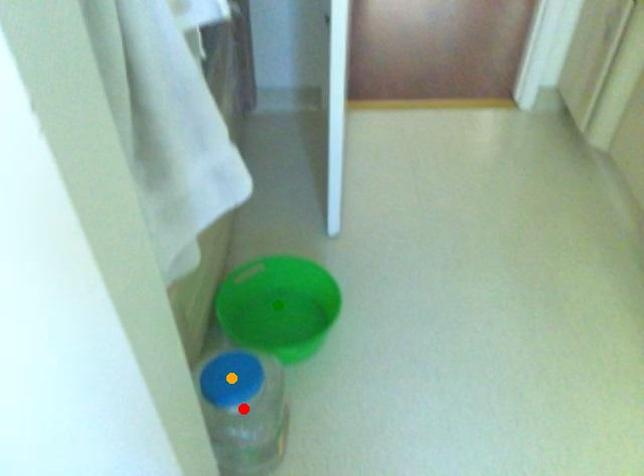
Looking at this image, order these from nearest to farthest:
A) green point
B) orange point
C) red point

red point, orange point, green point